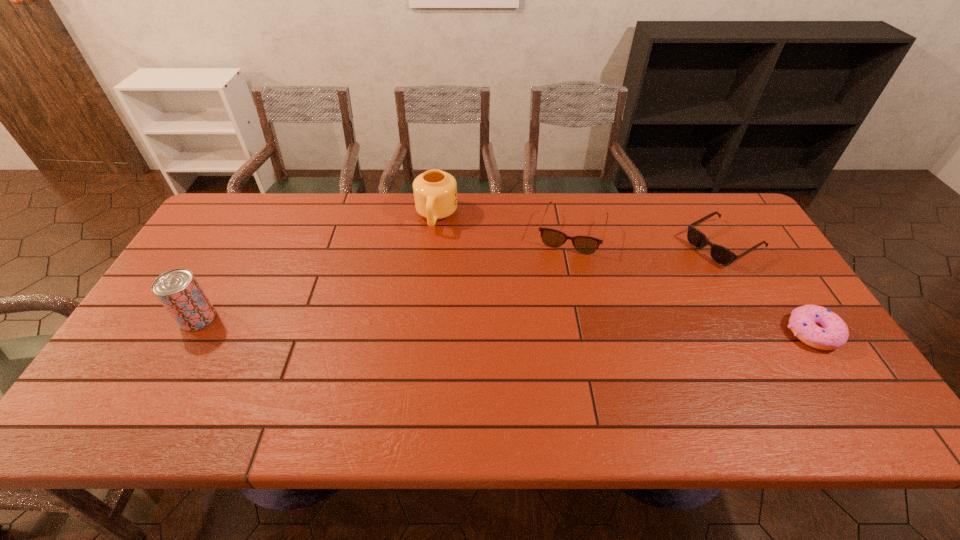
Where is `beer can`? The image size is (960, 540). beer can is located at coordinates (179, 292).

Where is `doughnut`? doughnut is located at coordinates (818, 327).

You are a GUI agent. You are given a task and a screenshot of the screen. Output one action in this format:
    pyautogui.click(x=<x>, y=<y>)
    Task: Click on the spectacles
    This screenshot has width=960, height=540.
    Given the screenshot: What is the action you would take?
    pyautogui.click(x=583, y=244)

The height and width of the screenshot is (540, 960). Identify the location of sunglasses. (721, 255).

This screenshot has width=960, height=540. I want to click on mug, so pyautogui.click(x=435, y=192).

The height and width of the screenshot is (540, 960). Find the location of `vacant space located 0.120m on the back of the beer can`. vacant space located 0.120m on the back of the beer can is located at coordinates (224, 273).

In order to click on vacant region located on the front of the doughnut in this screenshot , I will do `click(846, 383)`.

Where is `vacant space situated at the front view of the third object from left to right`? Image resolution: width=960 pixels, height=540 pixels. vacant space situated at the front view of the third object from left to right is located at coordinates (561, 269).

Where is `vacant position located at the front view of the third object from left to right`? vacant position located at the front view of the third object from left to right is located at coordinates pyautogui.click(x=544, y=327).

At what (x,y) coordinates should I click in order to perform the action: click on vacant space situated 0.140m at the front view of the third object from left to right. Please return your answer as a coordinate pair (x, y). Image resolution: width=960 pixels, height=540 pixels. Looking at the image, I should click on (555, 289).